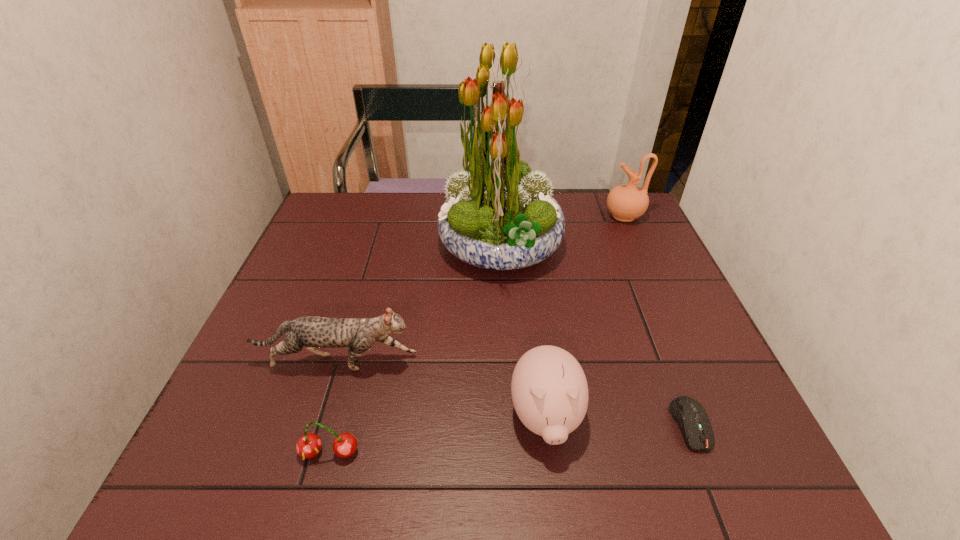
Select which object is the closest to the flower arrangement. Please provide its 2D coordinates. Your answer should be formatted as a tuple, i.e. [(x, y)], where the tuple contains the x and y coordinates of a point satisfying the conditions above.

[(627, 202)]

I want to click on object that is the second closest to the pottery, so click(549, 389).

Where is `blank space that satisfies the following two spatial constraints: 1. on the spout of the pottery; 2. with stems pointing upwards on the fifth tallest object`? blank space that satisfies the following two spatial constraints: 1. on the spout of the pottery; 2. with stems pointing upwards on the fifth tallest object is located at coordinates (730, 453).

The width and height of the screenshot is (960, 540). I want to click on free location that satisfies the following two spatial constraints: 1. on the spout of the second tallest object; 2. at the snout of the piggy bank, so click(713, 417).

Image resolution: width=960 pixels, height=540 pixels. What are the coordinates of `vacant area that satisfies the following two spatial constraints: 1. on the spout of the pottery; 2. with stems pointing upwards on the second shortest object` in the screenshot? It's located at (730, 453).